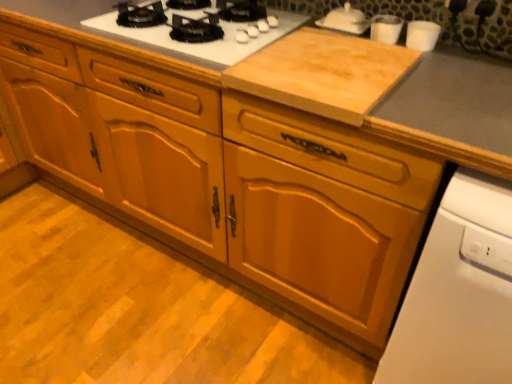
I want to click on vacant area to the left of white glossy cups at upper right, marked as the third appliance in a left-to-right arrangement, so click(x=367, y=46).